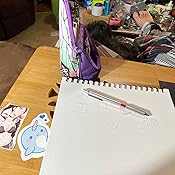
Locate an element on the screen. This screenshot has height=175, width=175. floor is located at coordinates (39, 33).